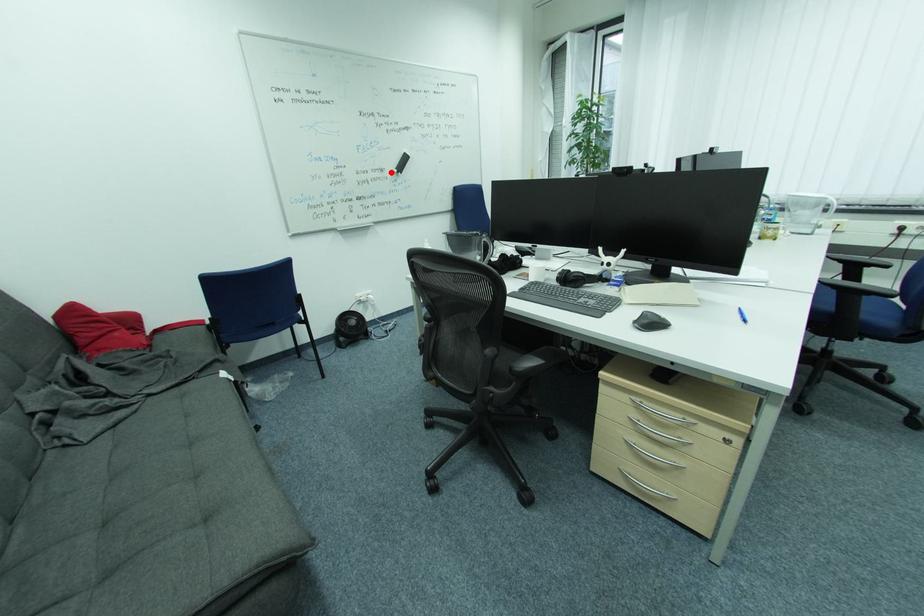
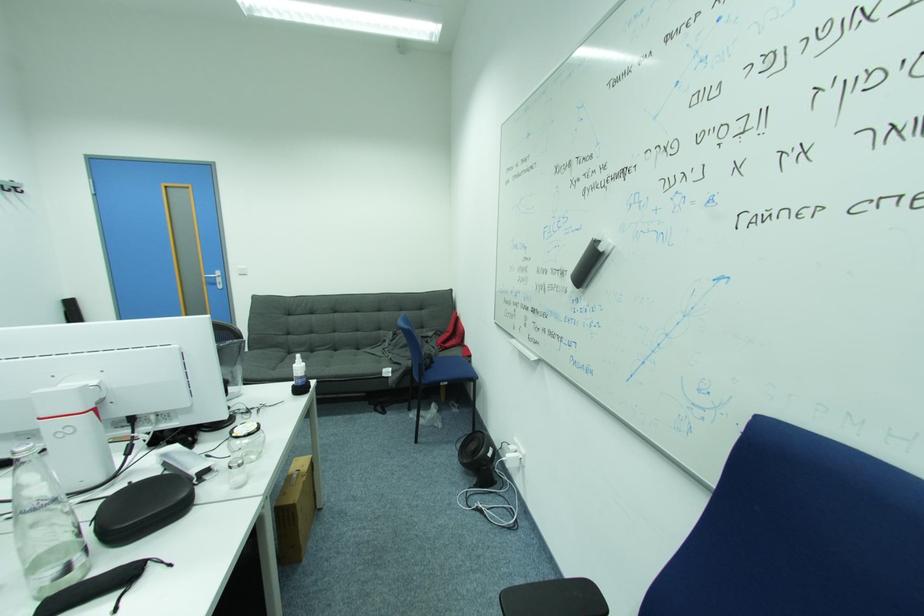
Locate, in the second image, the point that corresponds to the highlighted location in the first image.

(572, 277)